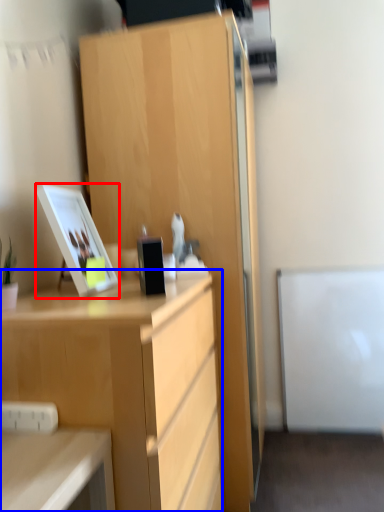
Question: Which point is closer to the camera, picture frame (highlighted by a red box) or desk (highlighted by a blue box)?

Choices:
 (A) picture frame
 (B) desk

Answer: (B)